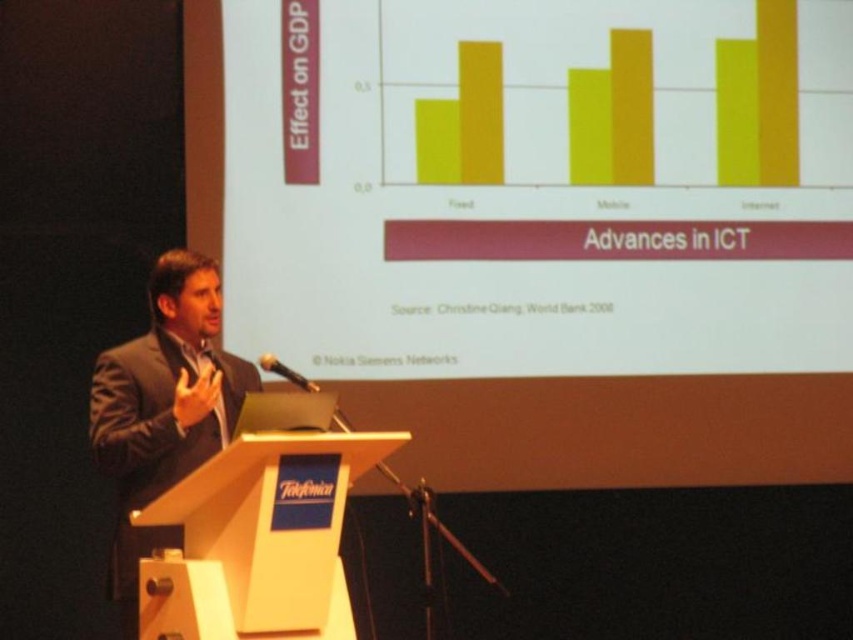
Who is positioned more to the right, wooden podium at center or dark suit at center?

wooden podium at center

Can you confirm if wooden podium at center is bigger than dark suit at center?

No, wooden podium at center is not bigger than dark suit at center.

Who is more distant from viewer, (207,520) or (170,458)?

The point (170,458) is behind.

Find the location of a particular element. This screenshot has height=640, width=853. wooden podium at center is located at coordinates (258, 540).